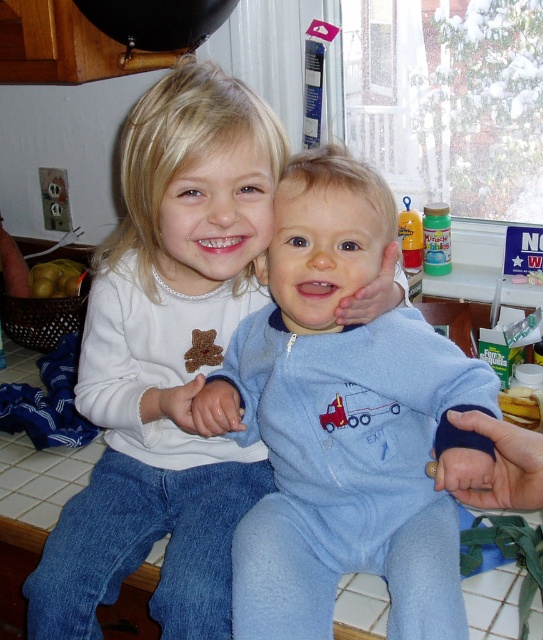
How distant is matte white shirt at center from blue fleece onesie at center?

matte white shirt at center is 4.55 inches from blue fleece onesie at center.

Can you confirm if matte white shirt at center is wider than blue fleece onesie at center?

Yes, matte white shirt at center is wider than blue fleece onesie at center.

Is point (251, 198) farther from viewer compared to point (276, 560)?

Yes, point (251, 198) is farther from viewer.

The image size is (543, 640). I want to click on matte white shirt at center, so click(x=167, y=362).